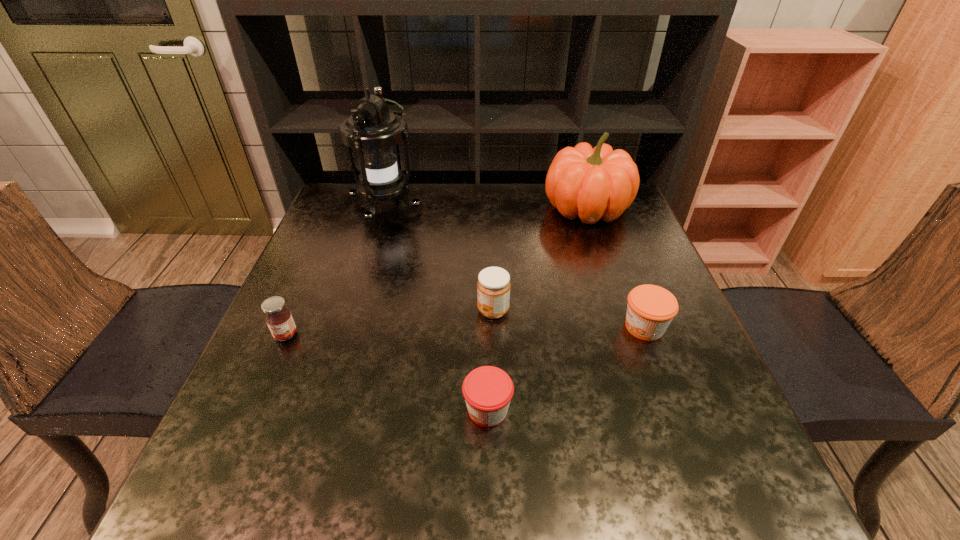
Identify the location of vacant region located 0.110m on the front label of the rightmost jam. (568, 327).

I want to click on vacant space located 0.370m on the front label of the rightmost jam, so click(x=445, y=327).

I want to click on vacant space situated on the label side of the nearest object, so click(x=406, y=409).

This screenshot has width=960, height=540. In order to click on vacant space situated on the label side of the nearest object in this screenshot , I will do `click(400, 409)`.

Where is `free space located 0.170m on the label side of the nearest object`? The height and width of the screenshot is (540, 960). free space located 0.170m on the label side of the nearest object is located at coordinates (367, 409).

Find the location of a particular element. lantern situated at the far edge is located at coordinates (x=373, y=130).

You are a GUI agent. You are given a task and a screenshot of the screen. Output one action in this format:
    pyautogui.click(x=<x>, y=<y>)
    Task: Click on the pumpkin that is at the far edge
    
    Given the screenshot: What is the action you would take?
    pyautogui.click(x=596, y=183)

At what (x,y) coordinates should I click in order to perform the action: click on lantern that is positioned at the left edge. Please return your answer as a coordinate pair (x, y). Looking at the image, I should click on (373, 130).

At what (x,y) coordinates should I click in order to perform the action: click on jam present at the left edge. Please return your answer as a coordinate pair (x, y). This screenshot has height=540, width=960. Looking at the image, I should click on click(278, 317).

Find the location of a particular element. pumpkin that is at the right edge is located at coordinates (596, 183).